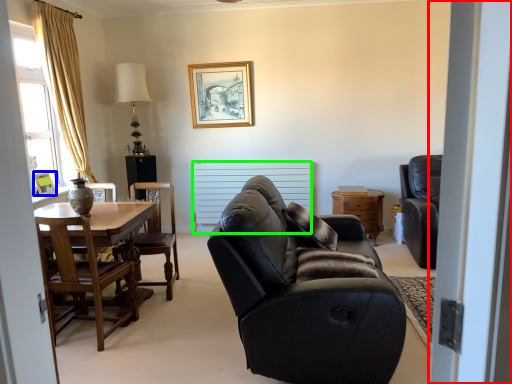
Question: Which object is positioned farthest from screen door (highlighted by a red box)? Select from picture frame (highlighted by a blue box) and radiator (highlighted by a green box).

Choices:
 (A) picture frame
 (B) radiator

Answer: (B)